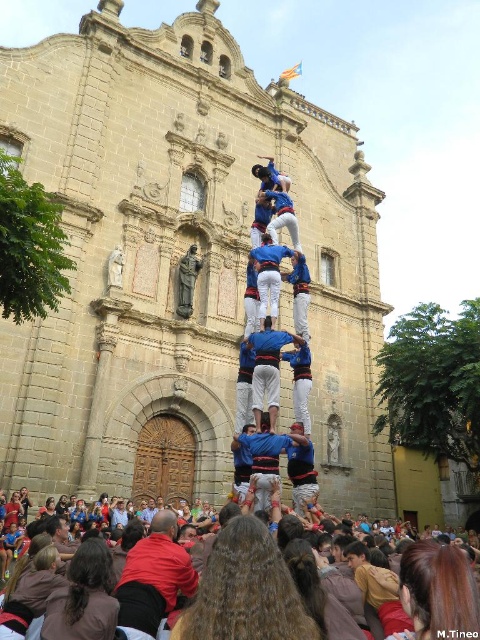
Question: Can you confirm if stone church at center is positioned to the left of blue fabric shirt at center?

Choices:
 (A) yes
 (B) no

Answer: (B)

Question: Does blue fabric shirt at center appear over blue fabric man at center?

Choices:
 (A) yes
 (B) no

Answer: (A)

Question: Which object is positioned farthest from the blue fabric shirt at center?

Choices:
 (A) brown fabric crowd at lower center
 (B) red shirt at center
 (C) blue fabric man at center

Answer: (A)

Question: Can you confirm if stone church at center is thinner than brown fabric crowd at lower center?

Choices:
 (A) no
 (B) yes

Answer: (A)

Question: Which point is farther from the camera taking this photo?

Choices:
 (A) (132, 570)
 (B) (440, 618)
 (C) (265, 346)
 (D) (271, 490)

Answer: (C)

Question: Among these points, which one is nearest to the camera?

Choices:
 (A) (384, 314)
 (B) (261, 508)
 (C) (289, 333)

Answer: (B)